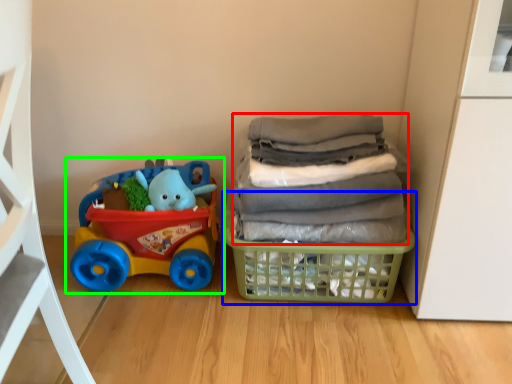
Question: Based on their relative distances, which object is nearer to laundry (highlighted by a red box)? Choose from basket (highlighted by a blue box) and toy (highlighted by a green box).

Choices:
 (A) basket
 (B) toy

Answer: (A)